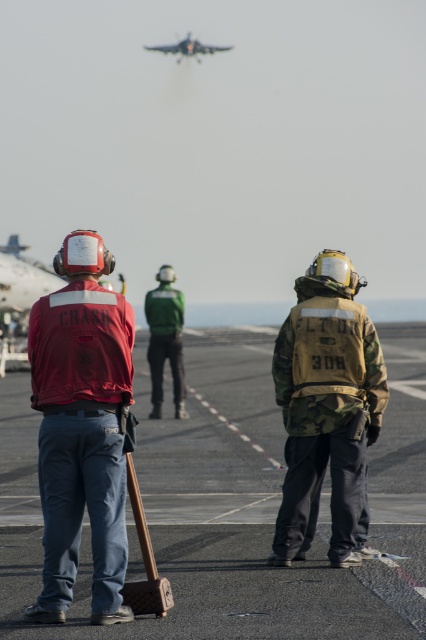
Which of these two, green fabric jacket at center or metallic silver jet at upper center, stands taller?

Standing taller between the two is metallic silver jet at upper center.

Is point (147, 324) positioned before point (176, 45)?

Yes, it is.

Is point (166, 324) positioned in front of point (161, 49)?

Yes, point (166, 324) is in front of point (161, 49).

This screenshot has height=640, width=426. I want to click on green fabric jacket at center, so click(166, 340).

Measure the distance between point [351,368] and camera.

The distance of point [351,368] from camera is 9.44 meters.

Does camo fabric backpack at center have a lesser width compared to green fabric jacket at center?

No, camo fabric backpack at center is not thinner than green fabric jacket at center.

Which is behind, point (342, 490) or point (161, 305)?

Positioned behind is point (161, 305).

Find the location of a particular element. camo fabric backpack at center is located at coordinates (325, 406).

Can you confirm if matte red jacket at left is wider than camo fabric backpack at center?

No.

Looking at this image, who is positioned more to the right, matte red jacket at left or camo fabric backpack at center?

Positioned to the right is camo fabric backpack at center.

At what (x,y) coordinates should I click in order to perform the action: click on matte red jacket at left. Please return your answer as a coordinate pair (x, y). This screenshot has width=426, height=640. Looking at the image, I should click on (81, 428).

The width and height of the screenshot is (426, 640). In order to click on matte red jacket at left in this screenshot , I will do `click(81, 428)`.